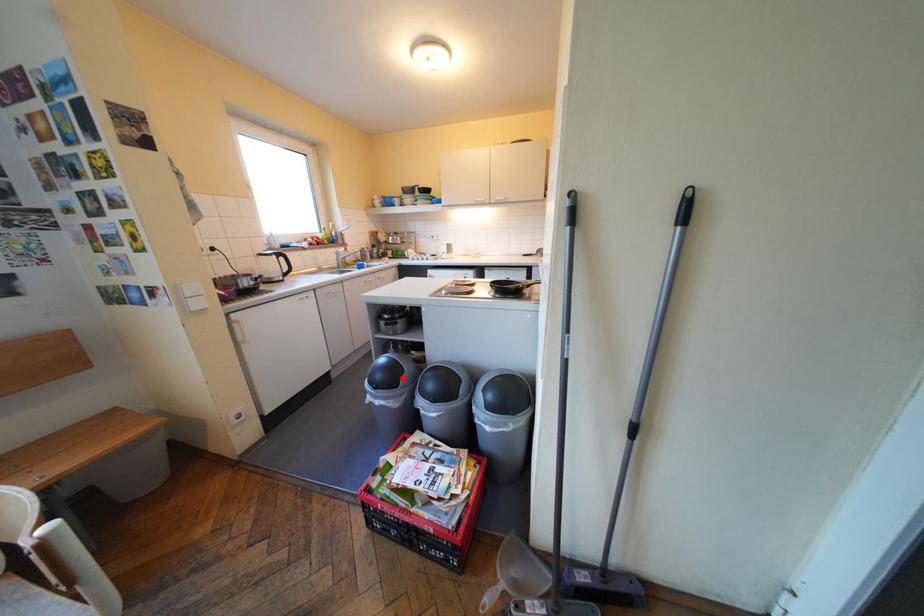
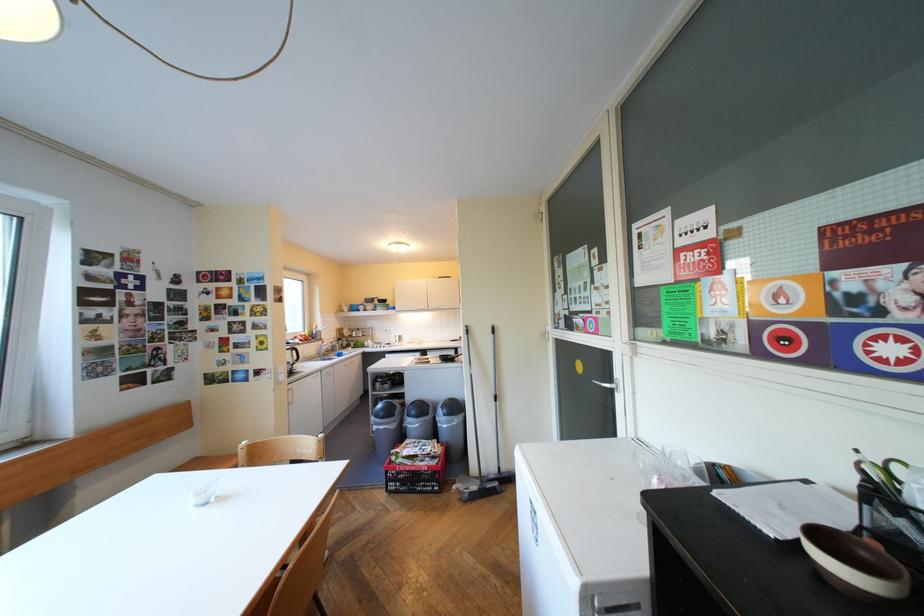
Question: A red point is marked in image1. In image2, is the corresponding 3D point closer to the camera or farther? Reply with the corresponding letter.

Choices:
 (A) The corresponding 3D point is closer.
 (B) The corresponding 3D point is farther.

Answer: (B)